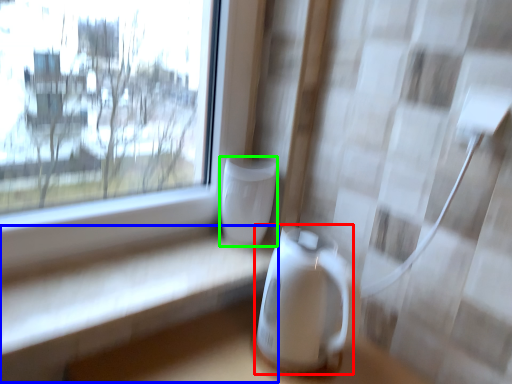
Question: Considering the real-world distances, which object is farthest from appliance (highlighted by a red box)? table (highlighted by a blue box) or appliance (highlighted by a green box)?

Choices:
 (A) table
 (B) appliance

Answer: (A)